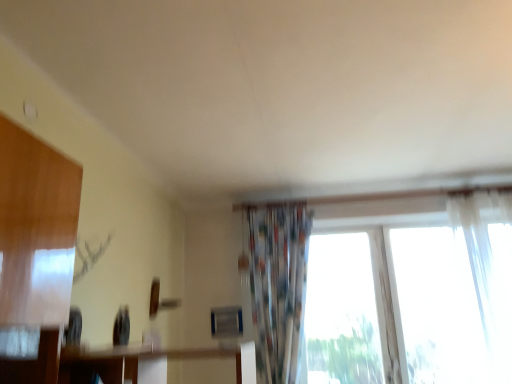
Question: Is transparent fabric at right taller than white sheer curtain at right, which is the second curtain in left-to-right order?

Choices:
 (A) yes
 (B) no

Answer: (B)

Question: Can you confirm if transparent fabric at right is shorter than white sheer curtain at right, placed as the first curtain when sorted from right to left?

Choices:
 (A) no
 (B) yes

Answer: (B)

Question: Is transparent fabric at right looking in the opposite direction of white sheer curtain at right, which is the second curtain in left-to-right order?

Choices:
 (A) yes
 (B) no

Answer: (B)

Question: Does transparent fabric at right have a lesser width compared to white sheer curtain at right, which is the second curtain in left-to-right order?

Choices:
 (A) yes
 (B) no

Answer: (A)

Question: Can you confirm if transparent fabric at right is smaller than white sheer curtain at right, placed as the first curtain when sorted from right to left?

Choices:
 (A) no
 (B) yes

Answer: (B)

Question: From the image's perspective, is transparent fabric at right on white sheer curtain at right, placed as the first curtain when sorted from right to left?

Choices:
 (A) no
 (B) yes

Answer: (A)

Question: Is transparent fabric at right at the back of white sheer curtain at right, placed as the first curtain when sorted from right to left?

Choices:
 (A) no
 (B) yes

Answer: (A)

Question: From a real-world perspective, is white sheer curtain at right, placed as the first curtain when sorted from right to left, located higher than transparent fabric at right?

Choices:
 (A) no
 (B) yes

Answer: (B)

Question: From the image's perspective, would you say white sheer curtain at right, which is the second curtain in left-to-right order, is positioned over transparent fabric at right?

Choices:
 (A) no
 (B) yes

Answer: (B)

Question: From the image's perspective, is white sheer curtain at right, placed as the first curtain when sorted from right to left, located beneath transparent fabric at right?

Choices:
 (A) yes
 (B) no

Answer: (B)

Question: From a real-world perspective, is white sheer curtain at right, which is the second curtain in left-to-right order, beneath transparent fabric at right?

Choices:
 (A) no
 (B) yes

Answer: (A)

Question: Considering the relative sizes of white sheer curtain at right, placed as the first curtain when sorted from right to left, and transparent fabric at right in the image provided, is white sheer curtain at right, placed as the first curtain when sorted from right to left, shorter than transparent fabric at right?

Choices:
 (A) yes
 (B) no

Answer: (B)

Question: Is white sheer curtain at right, which is the second curtain in left-to-right order, oriented away from printed fabric curtain at center, which appears as the first curtain when viewed from the left?

Choices:
 (A) no
 (B) yes

Answer: (A)